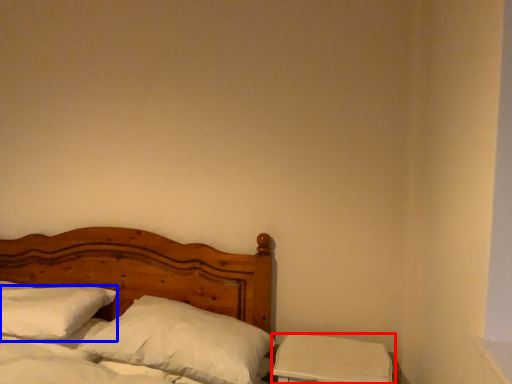
Question: Which object is closer to the camera taking this photo, nightstand (highlighted by a red box) or pillow (highlighted by a blue box)?

Choices:
 (A) nightstand
 (B) pillow

Answer: (A)